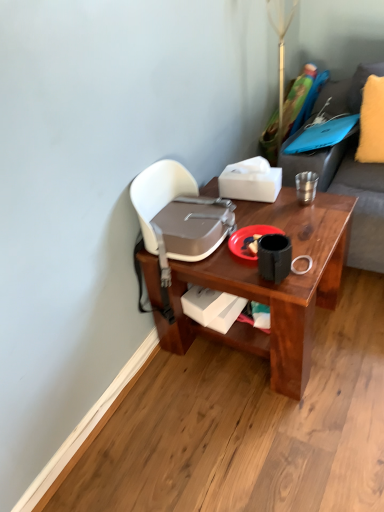
I want to click on free space in front of metallic silver coffee cup at upper right, so click(314, 218).